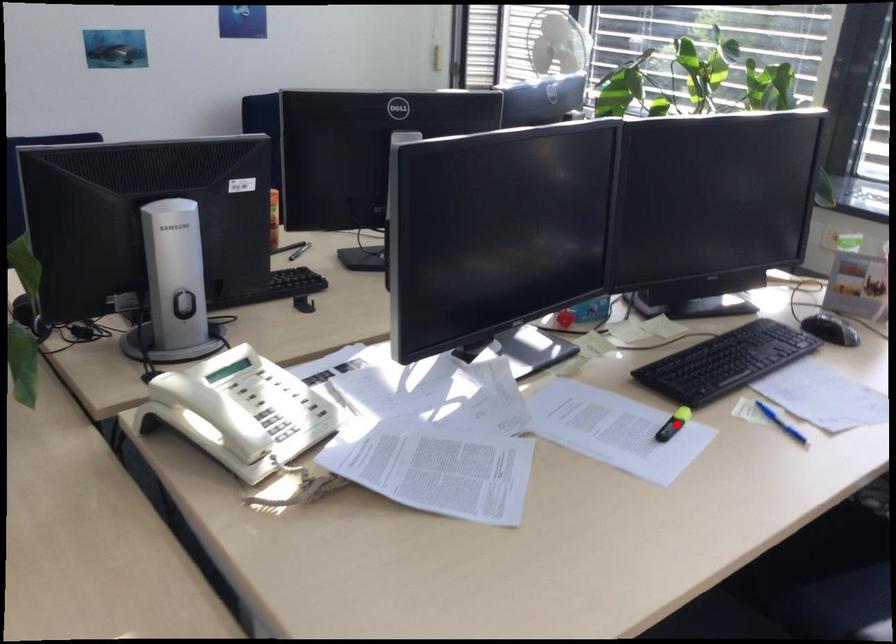
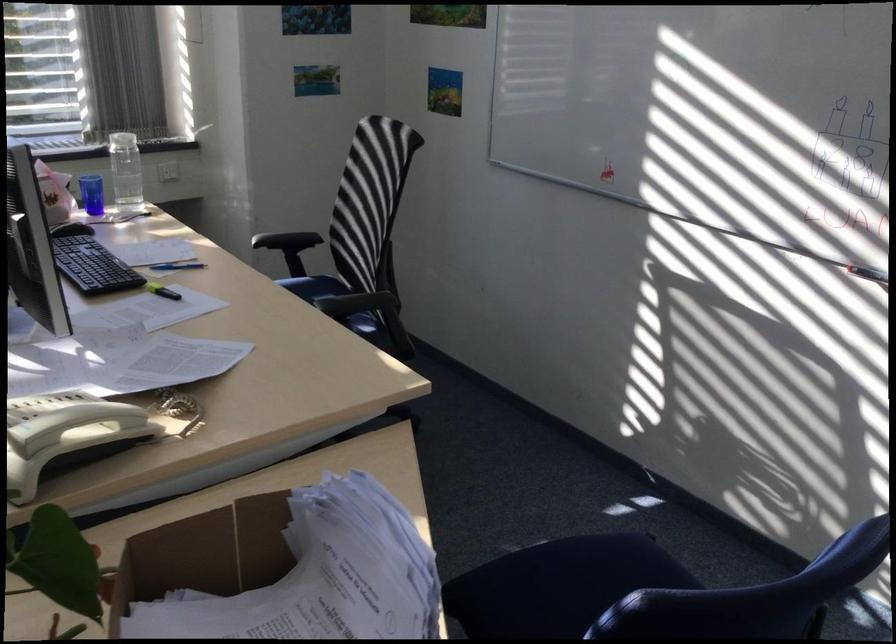
Question: A red point is marked in image1. In image2, is the corresponding 3D point closer to the camera or farther? Reply with the corresponding letter.

Choices:
 (A) The corresponding 3D point is closer.
 (B) The corresponding 3D point is farther.

Answer: (B)